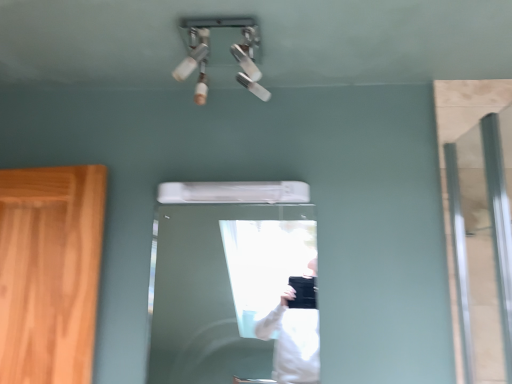
Question: Is clear glass door at right looking in the opposite direction of white glossy door at center?

Choices:
 (A) no
 (B) yes

Answer: (A)

Question: Is the depth of clear glass door at right less than that of white glossy door at center?

Choices:
 (A) yes
 (B) no

Answer: (A)

Question: Is clear glass door at right not close to white glossy door at center?

Choices:
 (A) yes
 (B) no

Answer: (A)

Question: Is clear glass door at right to the right of white glossy door at center from the viewer's perspective?

Choices:
 (A) no
 (B) yes

Answer: (B)

Question: Is clear glass door at right wider than white glossy door at center?

Choices:
 (A) yes
 (B) no

Answer: (A)

Question: Does clear glass door at right turn towards white glossy door at center?

Choices:
 (A) no
 (B) yes

Answer: (B)

Question: Does white glossy door at center have a smaller size compared to clear glass door at right?

Choices:
 (A) no
 (B) yes

Answer: (B)

Question: Is the depth of white glossy door at center greater than that of clear glass door at right?

Choices:
 (A) no
 (B) yes

Answer: (B)

Question: Is white glossy door at center facing away from clear glass door at right?

Choices:
 (A) no
 (B) yes

Answer: (A)

Question: Does white glossy door at center turn towards clear glass door at right?

Choices:
 (A) no
 (B) yes

Answer: (A)

Question: Would you say white glossy door at center is outside clear glass door at right?

Choices:
 (A) yes
 (B) no

Answer: (A)

Question: Considering the relative positions of white glossy door at center and clear glass door at right in the image provided, is white glossy door at center to the right of clear glass door at right from the viewer's perspective?

Choices:
 (A) no
 (B) yes

Answer: (A)

Question: Looking at their shapes, would you say white glossy door at center is wider or thinner than clear glass door at right?

Choices:
 (A) thin
 (B) wide

Answer: (A)